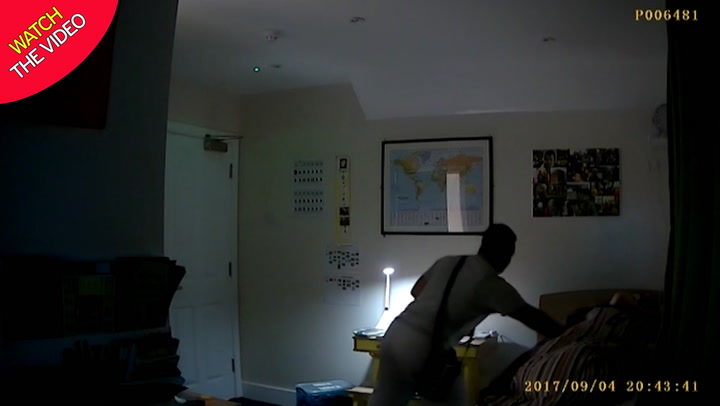
Where is `ceiling`? ceiling is located at coordinates (445, 61).